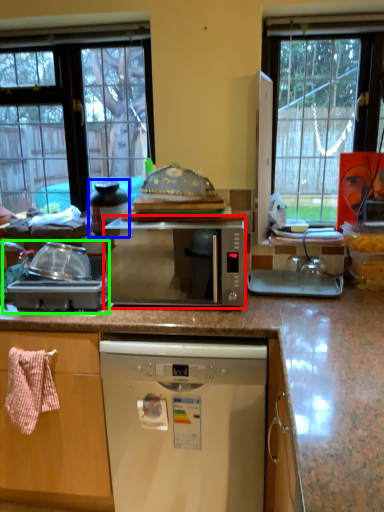
Question: Based on their relative distances, which object is farther from microwave oven (highlighted by a red box)? Choose from appliance (highlighted by a blue box) and appliance (highlighted by a green box).

Choices:
 (A) appliance
 (B) appliance

Answer: (A)